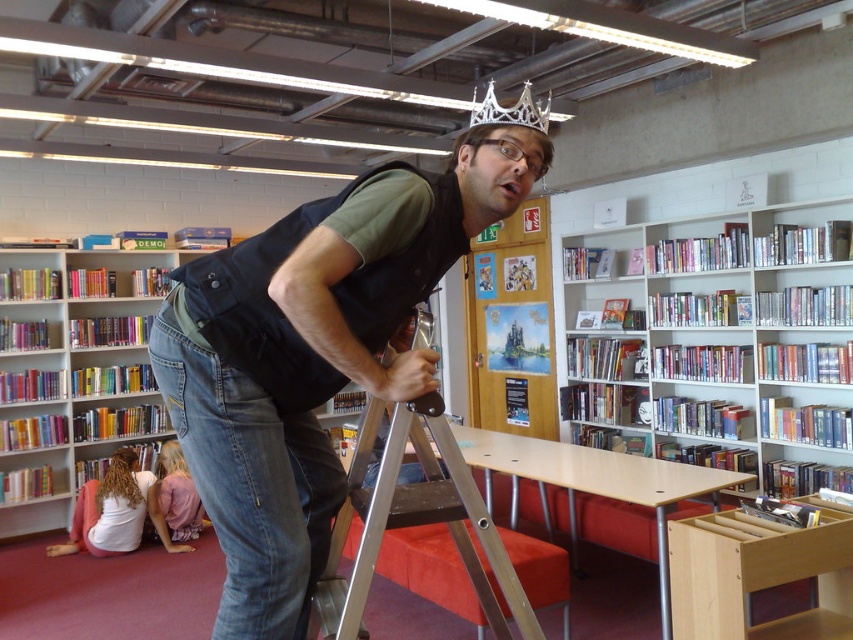
You are an observer in the library scene. You notice the matte black vest at center and the white glossy bookcase at upper center. Which object is closer to you? Please explain based on their positions.

The matte black vest at center is closer to you because it is positioned in front of the white glossy bookcase at upper center.

You are a delivery person who needs to place a package between the matte black vest at center and the white glossy bookcase at upper center. The package requires a space of 3 meters. Can you fit it between them?

The distance between the matte black vest at center and the white glossy bookcase at upper center is 3.82 meters, which is more than enough to accommodate the 3 meter package.